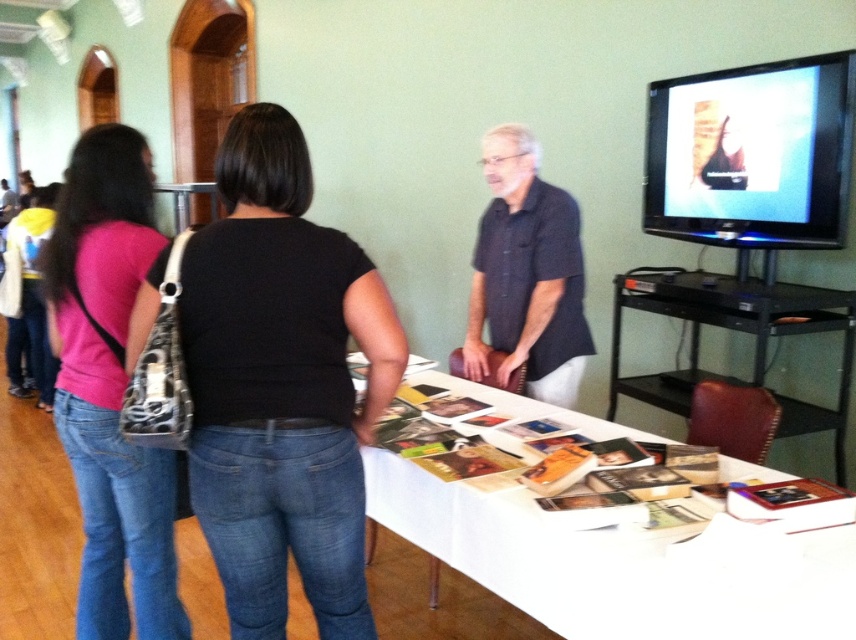
Does black denim jeans at lower left appear on the right side of pink fabric purse at left?

Correct, you'll find black denim jeans at lower left to the right of pink fabric purse at left.

Which is more to the right, black denim jeans at lower left or pink fabric purse at left?

Positioned to the right is black denim jeans at lower left.

Which is behind, point (277, 458) or point (144, 260)?

Point (144, 260)

Find the location of a particular element. The width and height of the screenshot is (856, 640). black denim jeans at lower left is located at coordinates (282, 385).

Which is more to the right, white paper at center or pink fabric purse at left?

white paper at center is more to the right.

Who is more forward, (813,579) or (110,480)?

Point (813,579) is in front.

At what (x,y) coordinates should I click in order to perform the action: click on white paper at center. Please return your answer as a coordinate pair (x, y). The height and width of the screenshot is (640, 856). Looking at the image, I should click on (614, 566).

Does pink fabric purse at left appear on the right side of dark blue shirt at center?

In fact, pink fabric purse at left is to the left of dark blue shirt at center.

Is point (74, 428) closer to camera compared to point (501, 308)?

That is True.

The height and width of the screenshot is (640, 856). I want to click on pink fabric purse at left, so click(110, 387).